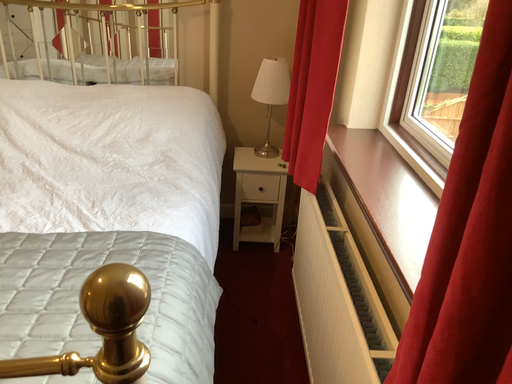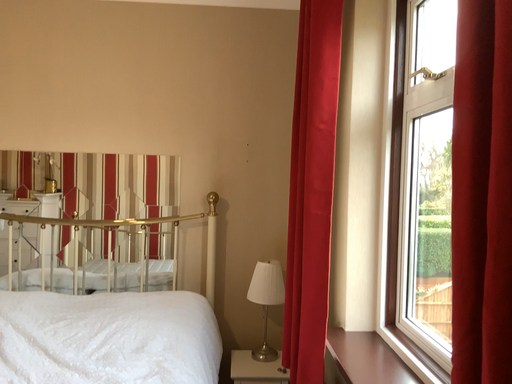
Question: Which way did the camera rotate in the video?

Choices:
 (A) rotated downward
 (B) rotated upward

Answer: (B)